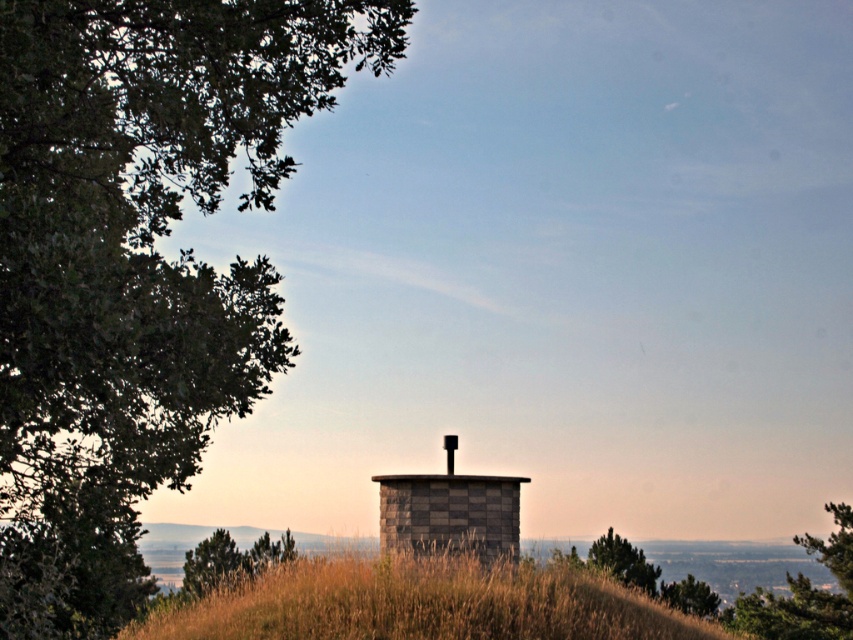
Question: Where is brown grassy hillside at center located in relation to green textured tree at center in the image?

Choices:
 (A) left
 (B) right

Answer: (A)

Question: Is green leafy tree at upper left wider than brown grassy hillside at center?

Choices:
 (A) yes
 (B) no

Answer: (B)

Question: Which object is farther from the camera taking this photo?

Choices:
 (A) green textured tree at center
 (B) brown grassy hillside at center

Answer: (A)

Question: Does gray stone water tower at center come behind green leafy tree at center?

Choices:
 (A) no
 (B) yes

Answer: (A)

Question: Based on their relative distances, which object is nearer to the gray stone water tower at center?

Choices:
 (A) green leafy tree at upper left
 (B) green textured tree at center

Answer: (A)

Question: Which object appears closest to the camera in this image?

Choices:
 (A) green leafy tree at upper left
 (B) brown grassy hillside at center
 (C) gray stone water tower at center
 (D) green textured tree at center

Answer: (A)